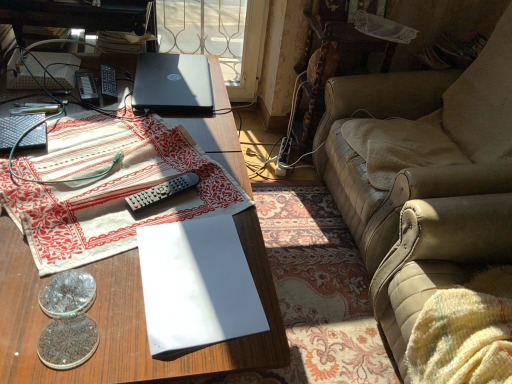
Image resolution: width=512 pixels, height=384 pixels. What are the coordinates of `free point to the right of translucent glass coins at lower left, the first coin viewed from the front` in the screenshot? It's located at (143, 352).